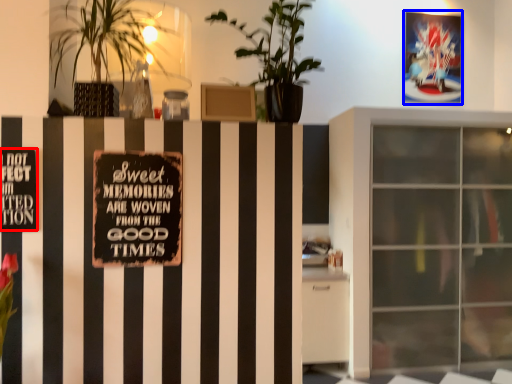
Question: Which object appears farthest to the camera in this image, warning sign (highlighted by a red box) or postcard (highlighted by a blue box)?

Choices:
 (A) warning sign
 (B) postcard

Answer: (B)